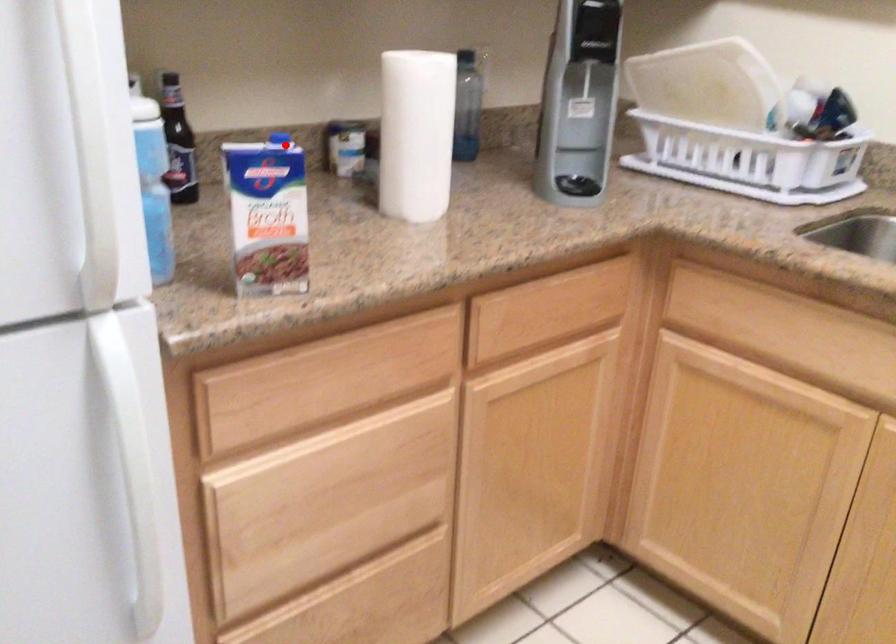
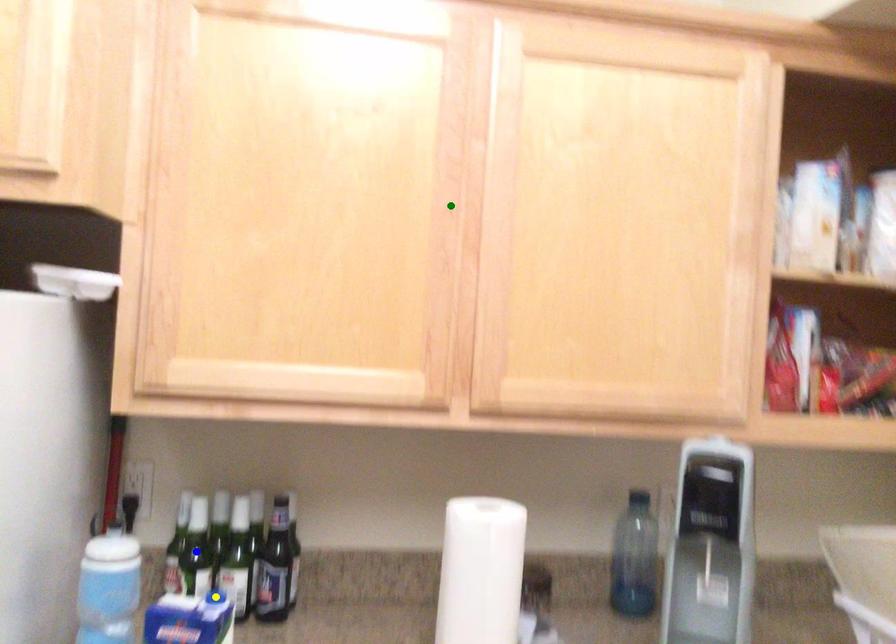
Question: I am providing you with two images of the same scene from different viewpoints. A red point is marked on the first image. You are given multiple points on the second image. Can you choose the point in image 2 that corresponds to the point in image 1?

Choices:
 (A) yellow point
 (B) green point
 (C) blue point

Answer: (A)